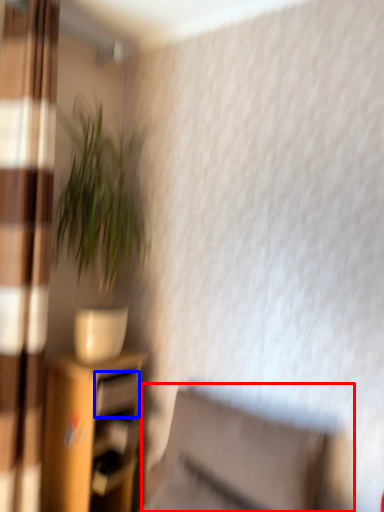
Question: Which object appears farthest to the camera in this image, swivel chair (highlighted by a red box) or drawer (highlighted by a blue box)?

Choices:
 (A) swivel chair
 (B) drawer

Answer: (B)